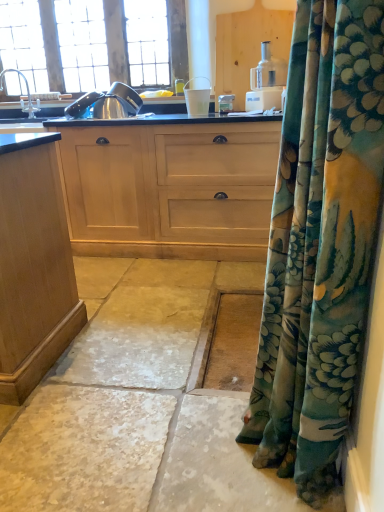
Identify the location of light wood cabinet at center. The image size is (384, 512). 170,186.

This screenshot has width=384, height=512. What do you see at coordinates (116, 41) in the screenshot? I see `wooden window at upper left` at bounding box center [116, 41].

You are a GUI agent. You are given a task and a screenshot of the screen. Output one action in this format:
    pyautogui.click(x=<x>, y=<y>)
    Task: Click on the wooden window at upper left
    The height and width of the screenshot is (512, 384).
    Given the screenshot: What is the action you would take?
    pyautogui.click(x=116, y=41)

The width and height of the screenshot is (384, 512). In order to click on white plastic cup at center in this screenshot , I will do `click(197, 99)`.

Find the location of a particular element. The width and height of the screenshot is (384, 512). white plastic food processor at upper center is located at coordinates (266, 82).

The height and width of the screenshot is (512, 384). Identify the location of satin nickel faucet at upper left. (27, 94).

In terms of size, does satin nickel faucet at upper left appear bigger or smaller than white plastic cup at center?

satin nickel faucet at upper left is bigger than white plastic cup at center.

At what (x,y) coordinates should I click in order to perform the action: click on faucet above the white plastic cup at center (from the image's perspective). Please return your answer as a coordinate pair (x, y). The image size is (384, 512). Looking at the image, I should click on (27, 94).

Is point (23, 103) in front of point (208, 108)?

No.

From the image's perspective, would you say satin nickel faucet at upper left is shown under white plastic cup at center?

Incorrect, from the image's perspective, satin nickel faucet at upper left is higher than white plastic cup at center.

Can you confirm if wooden window at upper left is bigger than satin nickel faucet at upper left?

Correct, wooden window at upper left is larger in size than satin nickel faucet at upper left.

From the image's perspective, relative to satin nickel faucet at upper left, is wooden window at upper left above or below?

Result: From the image's perspective, wooden window at upper left appears above satin nickel faucet at upper left.

This screenshot has width=384, height=512. Find the location of `faucet that is below the wooden window at upper left (from the image's perspective)`. faucet that is below the wooden window at upper left (from the image's perspective) is located at coordinates (27, 94).

From a real-world perspective, is wooden window at upper left over satin nickel faucet at upper left?

Yes.

Is satin nickel faucet at upper left not near white stone floor at lower center?

Yes.

Can you confirm if satin nickel faucet at upper left is smaller than white stone floor at lower center?

Indeed, satin nickel faucet at upper left has a smaller size compared to white stone floor at lower center.

From the image's perspective, between satin nickel faucet at upper left and white stone floor at lower center, who is located below?

white stone floor at lower center.

Find the location of a particular element. Image resolution: width=384 pixels, height=512 pixels. concrete in front of the satin nickel faucet at upper left is located at coordinates (137, 404).

Considering the sizes of white plastic food processor at upper center and light wood cabinet at center in the image, is white plastic food processor at upper center wider or thinner than light wood cabinet at center?

In the image, white plastic food processor at upper center appears to be more narrow than light wood cabinet at center.

Is white plastic food processor at upper center located outside light wood cabinet at center?

Yes, white plastic food processor at upper center is located beyond the bounds of light wood cabinet at center.

This screenshot has height=512, width=384. Identify the location of cabinetry that is below the white plastic food processor at upper center (from the image's perspective). pos(170,186).

Looking at this image, in terms of height, does light wood cabinet at center look taller or shorter compared to white plastic food processor at upper center?

Clearly, light wood cabinet at center is taller compared to white plastic food processor at upper center.

Is light wood cabinet at center to the right of white plastic food processor at upper center from the viewer's perspective?

No, light wood cabinet at center is not to the right of white plastic food processor at upper center.

You are a GUI agent. You are given a task and a screenshot of the screen. Output one action in this format:
    pyautogui.click(x=<x>, y=<y>)
    Task: Click on the cabinetry directly beneath the white plastic food processor at upper center (from a real-world perspective)
    
    Given the screenshot: What is the action you would take?
    pyautogui.click(x=170, y=186)

Relative to satin nickel faucet at upper left, is white stone floor at lower center in front or behind?

white stone floor at lower center is positioned closer to the viewer than satin nickel faucet at upper left.

Between white stone floor at lower center and satin nickel faucet at upper left, which one has more height?

satin nickel faucet at upper left.

Does white stone floor at lower center appear on the left side of satin nickel faucet at upper left?

No.

Consider the image. Considering the relative positions of white plastic cup at center and wooden window at upper left in the image provided, is white plastic cup at center in front of wooden window at upper left?

Yes, it is.

Would you say wooden window at upper left is part of white plastic cup at center's contents?

No, wooden window at upper left is located outside of white plastic cup at center.

Between white plastic cup at center and wooden window at upper left, which one has smaller width?

wooden window at upper left is thinner.

Can you tell me how much white plastic cup at center and wooden window at upper left differ in facing direction?

There is a 1.65-degree angle between the facing directions of white plastic cup at center and wooden window at upper left.

In order to click on appliance below the satin nickel faucet at upper left (from a real-world perspective) in this screenshot , I will do `click(197, 99)`.

You are a GUI agent. You are given a task and a screenshot of the screen. Output one action in this format:
    pyautogui.click(x=<x>, y=<y>)
    Task: Click on the window behind the satin nickel faucet at upper left
    
    Given the screenshot: What is the action you would take?
    pyautogui.click(x=116, y=41)

Based on their spatial positions, is wooden window at upper left or satin nickel faucet at upper left closer to white plastic cup at center?

Based on the image, satin nickel faucet at upper left appears to be nearer to white plastic cup at center.

Which object lies nearer to the anchor point light wood cabinet at center, white stone floor at lower center or white plastic food processor at upper center?

white plastic food processor at upper center is positioned closer to the anchor light wood cabinet at center.

Consider the image. Estimate the real-world distances between objects in this image. Which object is closer to white plastic food processor at upper center, wooden window at upper left or white plastic cup at center?

white plastic cup at center lies closer to white plastic food processor at upper center than the other object.

Looking at the image, which one is located closer to white plastic food processor at upper center, satin nickel faucet at upper left or light wood cabinet at center?

light wood cabinet at center lies closer to white plastic food processor at upper center than the other object.

When comparing their distances from wooden window at upper left, does white plastic food processor at upper center or white stone floor at lower center seem closer?

The object closer to wooden window at upper left is white plastic food processor at upper center.

Considering their positions, is satin nickel faucet at upper left positioned closer to light wood cabinet at center than wooden window at upper left?

satin nickel faucet at upper left.

Looking at the image, which one is located further to white plastic food processor at upper center, white stone floor at lower center or satin nickel faucet at upper left?

Based on the image, satin nickel faucet at upper left appears to be further to white plastic food processor at upper center.

When comparing their distances from white plastic food processor at upper center, does light wood cabinet at center or satin nickel faucet at upper left seem closer?

Among the two, light wood cabinet at center is located nearer to white plastic food processor at upper center.

The image size is (384, 512). I want to click on cabinetry between white stone floor at lower center and white plastic food processor at upper center from front to back, so click(170, 186).

Where is `appliance that lies between wooden window at upper left and light wood cabinet at center from top to bottom`? appliance that lies between wooden window at upper left and light wood cabinet at center from top to bottom is located at coordinates (197, 99).

Find the location of a particular element. The width and height of the screenshot is (384, 512). window between satin nickel faucet at upper left and white plastic cup at center from left to right is located at coordinates (116, 41).

The width and height of the screenshot is (384, 512). Identify the location of kitchen appliance between white stone floor at lower center and satin nickel faucet at upper left along the z-axis. (266, 82).